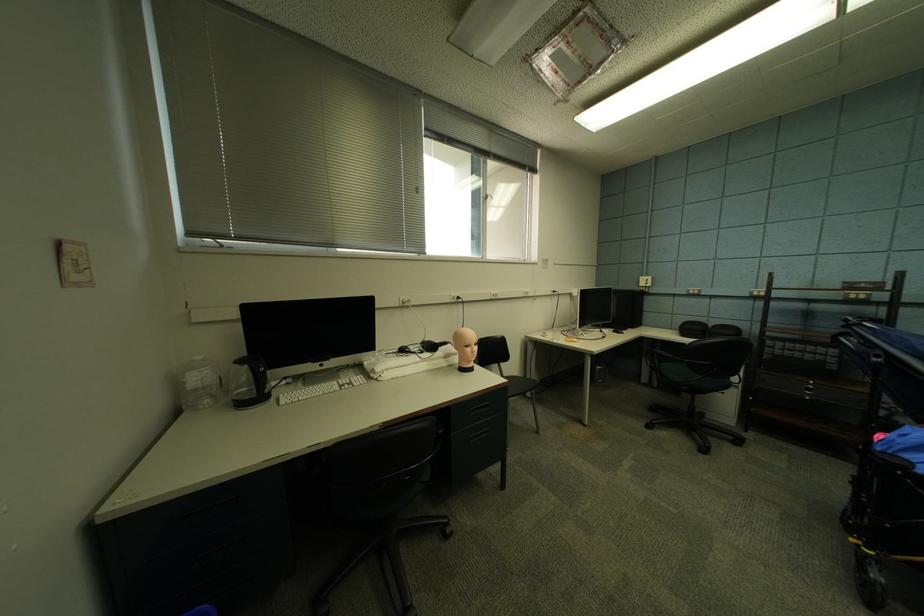
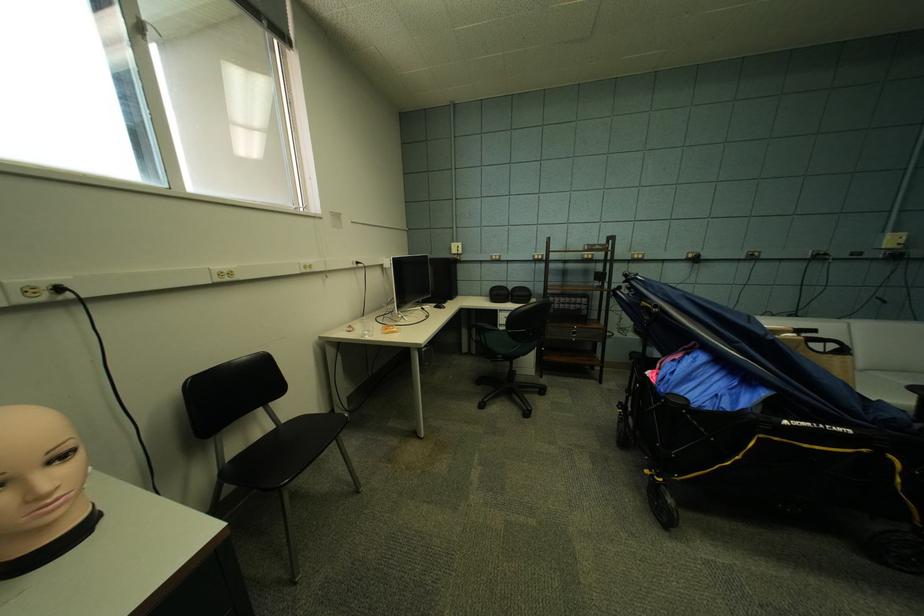
Where in the second image is the point corresponding to (x=872, y=286) from the first image?

(606, 248)